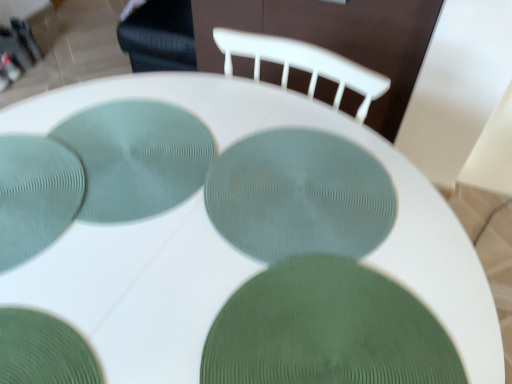
Locate an element on the screen. vacant area that lies between green textured plate at center, the 5th glass plate positioned from the left, and matte green plate at lower left, which is the first glass plate in left-to-right order is located at coordinates (138, 264).